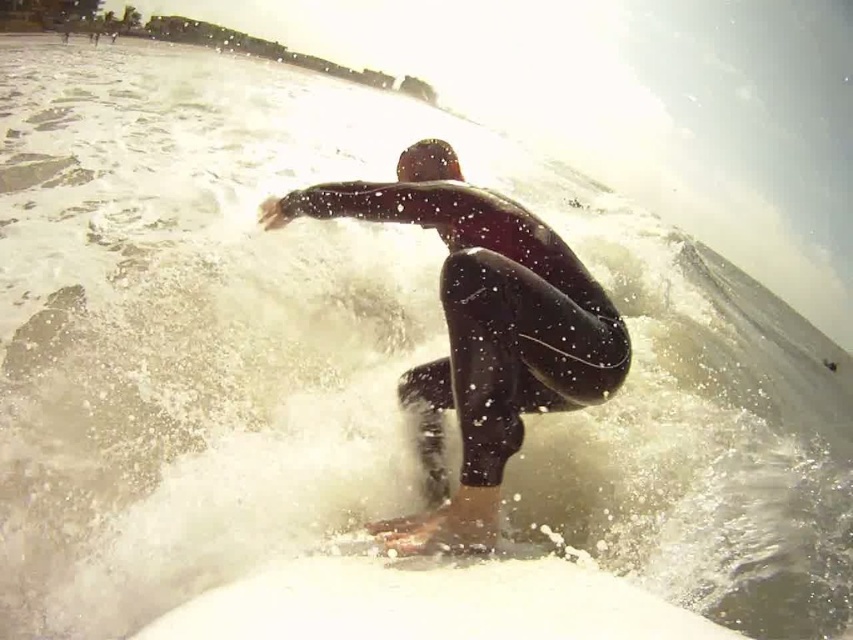
Question: Is black wetsuit surfer at center positioned behind white foam surfboard at center?

Choices:
 (A) no
 (B) yes

Answer: (B)

Question: Which point appears closest to the camera in this image?

Choices:
 (A) (207, 596)
 (B) (523, 244)

Answer: (A)

Question: Where is black wetsuit surfer at center located in relation to white foam surfboard at center in the image?

Choices:
 (A) below
 (B) above

Answer: (B)

Question: Does black wetsuit surfer at center appear on the left side of white foam surfboard at center?

Choices:
 (A) no
 (B) yes

Answer: (B)

Question: Which point is closer to the camera?

Choices:
 (A) (496, 209)
 (B) (183, 612)

Answer: (B)